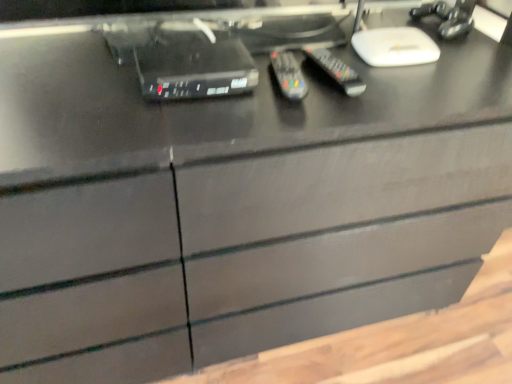
Where is `vacant area that lies in front of black plastic device at upper center`? The image size is (512, 384). vacant area that lies in front of black plastic device at upper center is located at coordinates (172, 125).